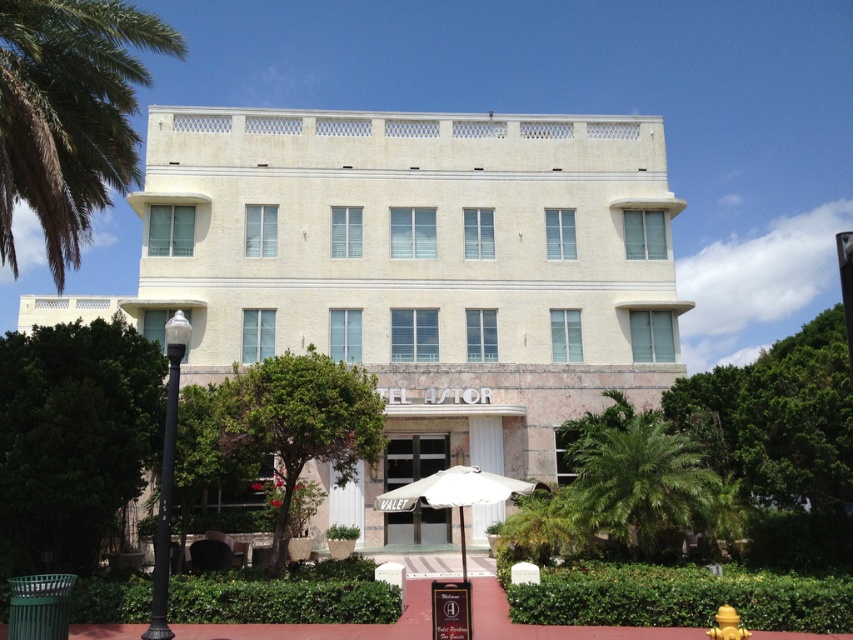
What is the relationship between the heights of the green leafy palm tree at upper left and the green leafy palm tree at lower right in the image?

The green leafy palm tree at upper left is taller than the green leafy palm tree at lower right.

You are standing at the entrance of the HOTEL ASTOR and want to take a photo of the white fabric umbrella at center without the green leafy palm tree at lower right blocking it. How should you position yourself?

Move to the side so that the green leafy palm tree at lower right is no longer in front of the white fabric umbrella at center. Since the white fabric umbrella at center is behind the green leafy palm tree at lower right, positioning yourself to the side of the palm tree will allow you to see the umbrella without obstruction.